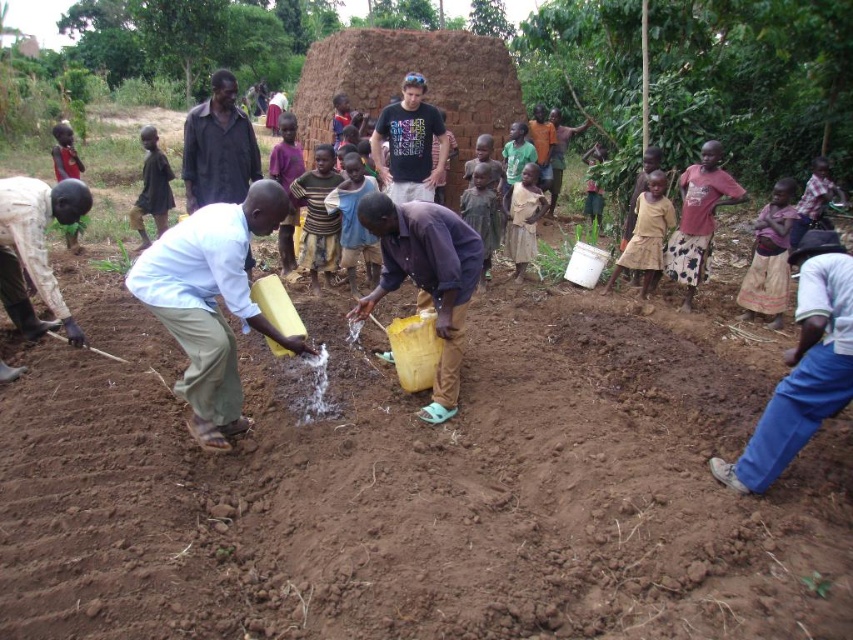
Can you confirm if brown textured dress at right is shorter than light brown wooden stick at center?

Yes.

Between brown textured dress at right and light brown wooden stick at center, which one appears on the right side from the viewer's perspective?

From the viewer's perspective, brown textured dress at right appears more on the right side.

Who is more forward, (647, 234) or (364, 250)?

Point (364, 250) is more forward.

This screenshot has height=640, width=853. In order to click on brown textured dress at right in this screenshot , I will do `click(646, 234)`.

Who is higher up, yellow matte bucket at center or brown woven skirt at right?

brown woven skirt at right

Is point (392, 257) positioned after point (757, 312)?

No, it is in front of (757, 312).

Between point (426, 204) and point (772, 260), which one is positioned behind?

Point (772, 260)

Where is `yellow matte bucket at center`? yellow matte bucket at center is located at coordinates (426, 278).

Is brown woven skirt at right smaller than striped fabric shirt at center?

Yes.

Does point (755, 305) come in front of point (310, 182)?

Yes.

This screenshot has height=640, width=853. In order to click on brown woven skirt at right in this screenshot , I will do `click(769, 257)`.